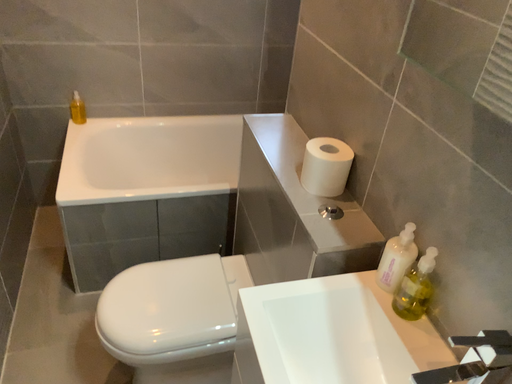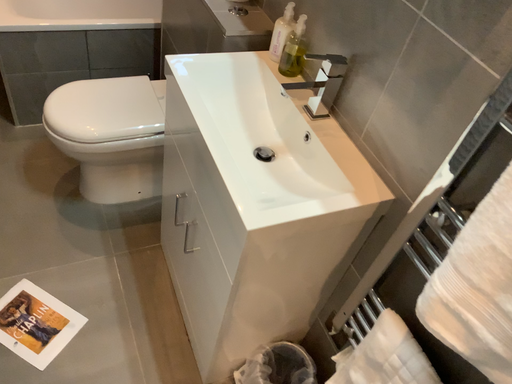
Question: Which way did the camera rotate in the video?

Choices:
 (A) rotated right
 (B) rotated left

Answer: (A)